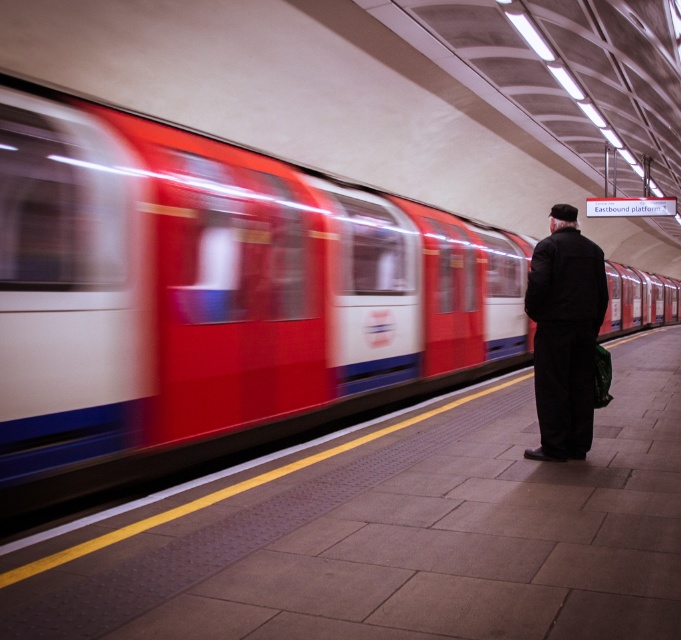
Who is more forward, (620,288) or (577,332)?

Positioned in front is point (577,332).

Is white glossy train at center in front of dark woolen coat at center?

Yes, white glossy train at center is closer to the viewer.

Between point (86, 316) and point (565, 266), which one is positioned behind?

Positioned behind is point (565, 266).

Image resolution: width=681 pixels, height=640 pixels. I want to click on white glossy train at center, so click(212, 296).